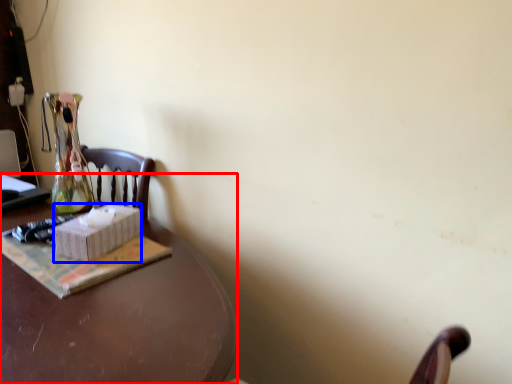
Question: Which of the following is the closest to the observer, desk (highlighted by a red box) or box (highlighted by a blue box)?

Choices:
 (A) desk
 (B) box

Answer: (A)